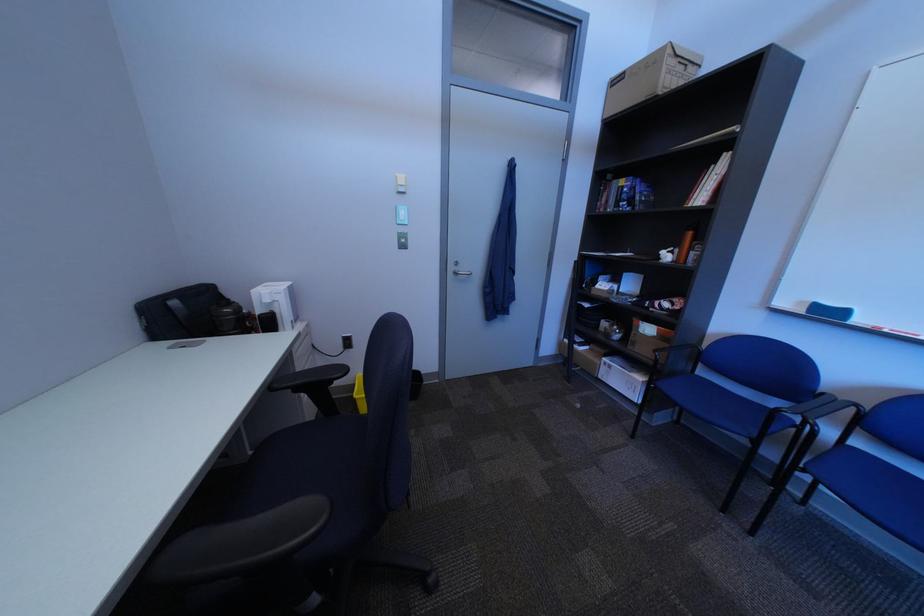
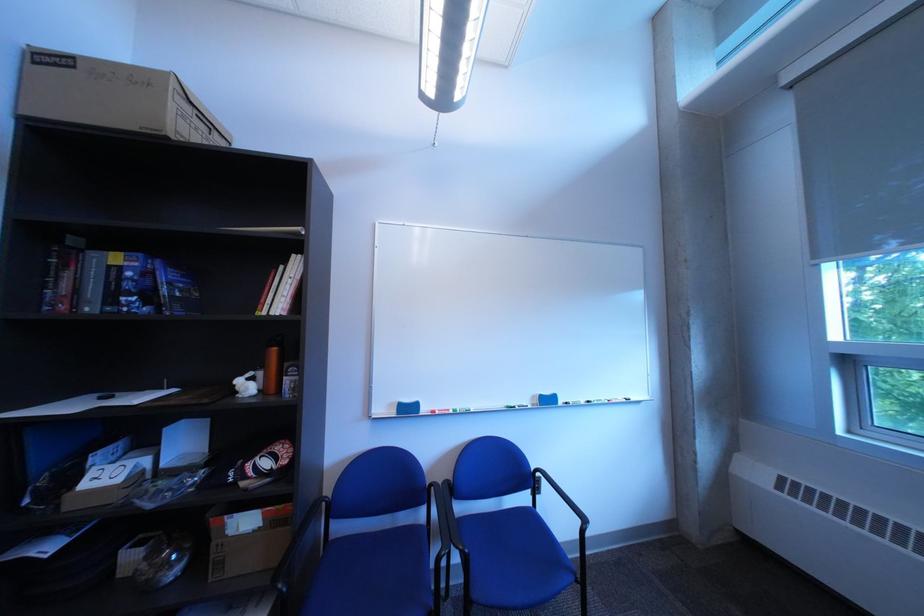
Where in the second image is the point corresponding to (727,169) from the first image?

(297, 270)